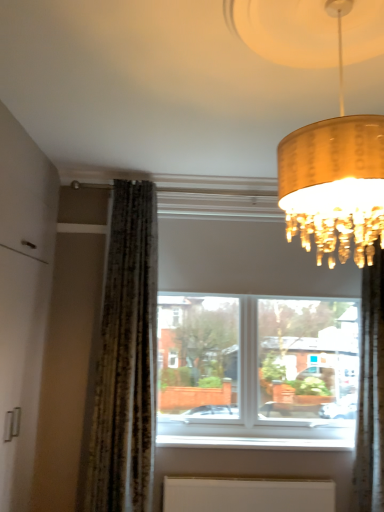
Question: From the image's perspective, is gold textured lampshade at upper right positioned above or below silky green curtain at right?

Choices:
 (A) below
 (B) above

Answer: (B)

Question: Considering the positions of gold textured lampshade at upper right and silky green curtain at right in the image, is gold textured lampshade at upper right wider or thinner than silky green curtain at right?

Choices:
 (A) wide
 (B) thin

Answer: (A)

Question: Based on their relative distances, which object is farther from the white smooth window sill at lower center?

Choices:
 (A) silky green curtain at right
 (B) white matte radiator at lower center
 (C) gold textured lampshade at upper right
 (D) transparent glass window at center

Answer: (C)

Question: Which is farther from the white matte radiator at lower center?

Choices:
 (A) transparent glass window at center
 (B) white smooth window sill at lower center
 (C) silky green curtain at right
 (D) gold textured lampshade at upper right

Answer: (D)